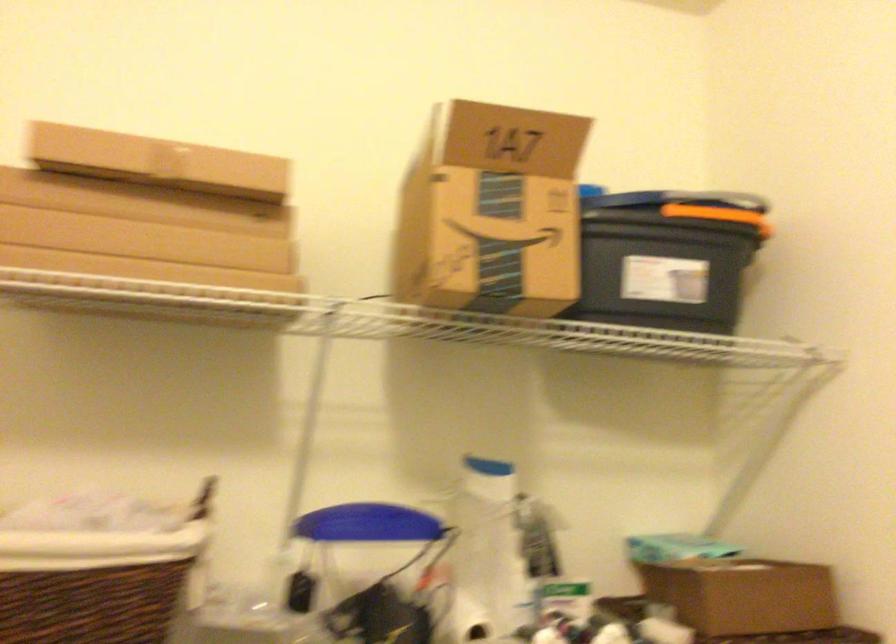
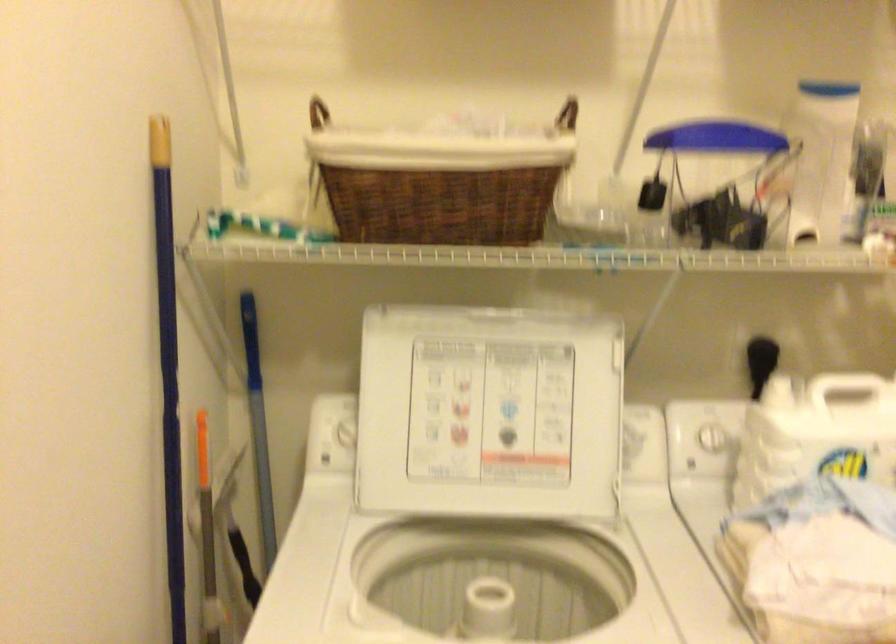
How did the camera likely rotate?

The camera rotated toward left-down.